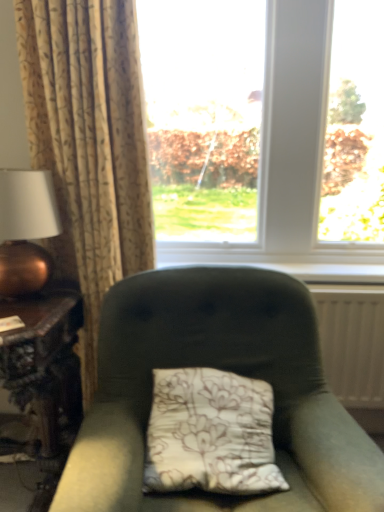
Identify the location of copper metallic table lamp at left. Image resolution: width=384 pixels, height=512 pixels. (26, 229).

What is the approximate width of wooden carved table at left?

The width of wooden carved table at left is 25.33 inches.

You are a GUI agent. You are given a task and a screenshot of the screen. Output one action in this format:
    pyautogui.click(x=<x>, y=<y>)
    Task: Click on the beige floral fabric curtain at left
    
    Given the screenshot: What is the action you would take?
    pyautogui.click(x=89, y=143)

The image size is (384, 512). I want to click on copper metallic table lamp at left, so click(26, 229).

From a real-world perspective, between wooden carved table at left and white painted wood at center, who is vertically higher?

white painted wood at center.

Can you confirm if wooden carved table at left is wider than white painted wood at center?

Correct, the width of wooden carved table at left exceeds that of white painted wood at center.

From the image's perspective, is wooden carved table at left positioned above or below white painted wood at center?

wooden carved table at left is below white painted wood at center.

Looking at this image, from their relative heights in the image, would you say wooden carved table at left is taller or shorter than white painted wood at center?

wooden carved table at left is taller than white painted wood at center.

From the picture: Is velvet green chair at center completely or partially outside of white textured radiator at right?

That's correct, velvet green chair at center is outside of white textured radiator at right.

Which object is more forward, velvet green chair at center or white textured radiator at right?

Positioned in front is velvet green chair at center.

Is velvet green chair at center placed right next to white textured radiator at right?

There is a gap between velvet green chair at center and white textured radiator at right.

Which of these two, velvet green chair at center or white textured radiator at right, is smaller?

Smaller between the two is white textured radiator at right.

Is transparent glass window at center wider or thinner than beige floral fabric curtain at left?

Considering their sizes, transparent glass window at center looks broader than beige floral fabric curtain at left.

Who is taller, transparent glass window at center or beige floral fabric curtain at left?

beige floral fabric curtain at left is taller.

Is transparent glass window at center positioned in front of beige floral fabric curtain at left?

No, transparent glass window at center is further to the viewer.

Between transparent glass window at center and beige floral fabric curtain at left, which one has larger size?

With larger size is transparent glass window at center.

Is copper metallic table lamp at left located outside wooden carved table at left?

Yes.

Considering the positions of point (10, 226) and point (18, 403), is point (10, 226) closer or farther from the camera than point (18, 403)?

Point (10, 226) is positioned closer to the camera compared to point (18, 403).

Is copper metallic table lamp at left further to the viewer compared to wooden carved table at left?

Yes, copper metallic table lamp at left is behind wooden carved table at left.

Based on their positions, is white textured radiator at right located to the left or right of velvet green chair at center?

white textured radiator at right is to the right of velvet green chair at center.

From their relative heights in the image, would you say white textured radiator at right is taller or shorter than velvet green chair at center?

Clearly, white textured radiator at right is shorter compared to velvet green chair at center.

Considering the sizes of white textured radiator at right and velvet green chair at center in the image, is white textured radiator at right wider or thinner than velvet green chair at center?

Considering their sizes, white textured radiator at right looks slimmer than velvet green chair at center.

Can velvet green chair at center be found inside white textured radiator at right?

No, velvet green chair at center is not surrounded by white textured radiator at right.

Is wooden carved table at left turned away from transparent glass window at center?

wooden carved table at left is not turned away from transparent glass window at center.

In the scene shown: Is wooden carved table at left to the left of transparent glass window at center from the viewer's perspective?

Indeed, wooden carved table at left is positioned on the left side of transparent glass window at center.

Is wooden carved table at left further to camera compared to transparent glass window at center?

No.

From the picture: Are wooden carved table at left and transparent glass window at center making contact?

wooden carved table at left and transparent glass window at center are clearly separated.

From a real-world perspective, is white textured radiator at right under white painted wood at center?

Yes.

Is point (348, 303) in front of point (281, 264)?

Yes, it is in front of point (281, 264).

From their relative heights in the image, would you say white textured radiator at right is taller or shorter than white painted wood at center?

In the image, white textured radiator at right appears to be taller than white painted wood at center.

Considering the sizes of objects white textured radiator at right and white painted wood at center in the image provided, who is wider, white textured radiator at right or white painted wood at center?

white painted wood at center is wider.

Where is `window sill above the wooden carved table at left (from the image's perspective)`? Image resolution: width=384 pixels, height=512 pixels. window sill above the wooden carved table at left (from the image's perspective) is located at coordinates (307, 270).

Locate an element on the screen. The image size is (384, 512). chair in front of the white textured radiator at right is located at coordinates click(x=217, y=368).

Looking at the image, which one is located further to transparent glass window at center, beige floral fabric curtain at left or copper metallic table lamp at left?

The object further to transparent glass window at center is copper metallic table lamp at left.

Estimate the real-world distances between objects in this image. Which object is further from velvet green chair at center, beige floral fabric curtain at left or copper metallic table lamp at left?

copper metallic table lamp at left is further to velvet green chair at center.

When comparing their distances from wooden carved table at left, does velvet green chair at center or beige floral fabric curtain at left seem closer?

Among the two, beige floral fabric curtain at left is located nearer to wooden carved table at left.

Based on their spatial positions, is wooden carved table at left or copper metallic table lamp at left further from beige floral fabric curtain at left?

wooden carved table at left lies further to beige floral fabric curtain at left than the other object.

Considering their positions, is velvet green chair at center positioned further to transparent glass window at center than white painted wood at center?

velvet green chair at center is positioned further to the anchor transparent glass window at center.

From the image, which object appears to be farther from white textured radiator at right, copper metallic table lamp at left or beige floral fabric curtain at left?

The object further to white textured radiator at right is copper metallic table lamp at left.

From the image, which object appears to be nearer to white painted wood at center, wooden carved table at left or copper metallic table lamp at left?

wooden carved table at left is positioned closer to the anchor white painted wood at center.

Based on their spatial positions, is beige floral fabric curtain at left or transparent glass window at center closer to white painted wood at center?

transparent glass window at center.

At what (x,y) coordinates should I click in order to perform the action: click on window located between velvet green chair at center and white painted wood at center in the depth direction. Please return your answer as a coordinate pair (x, y). Looking at the image, I should click on (265, 129).

At what (x,y) coordinates should I click in order to perform the action: click on curtain located between copper metallic table lamp at left and velvet green chair at center in the left-right direction. Please return your answer as a coordinate pair (x, y). The height and width of the screenshot is (512, 384). Looking at the image, I should click on (89, 143).

Where is `curtain between copper metallic table lamp at left and white painted wood at center in the horizontal direction`? curtain between copper metallic table lamp at left and white painted wood at center in the horizontal direction is located at coordinates (89, 143).

Identify the location of window located between copper metallic table lamp at left and white painted wood at center in the left-right direction. (265, 129).